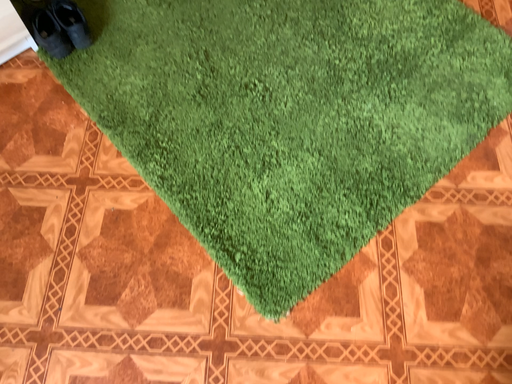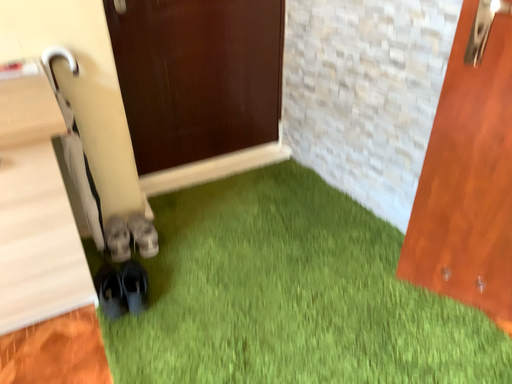
Question: Which way did the camera rotate in the video?

Choices:
 (A) rotated downward
 (B) rotated upward

Answer: (B)